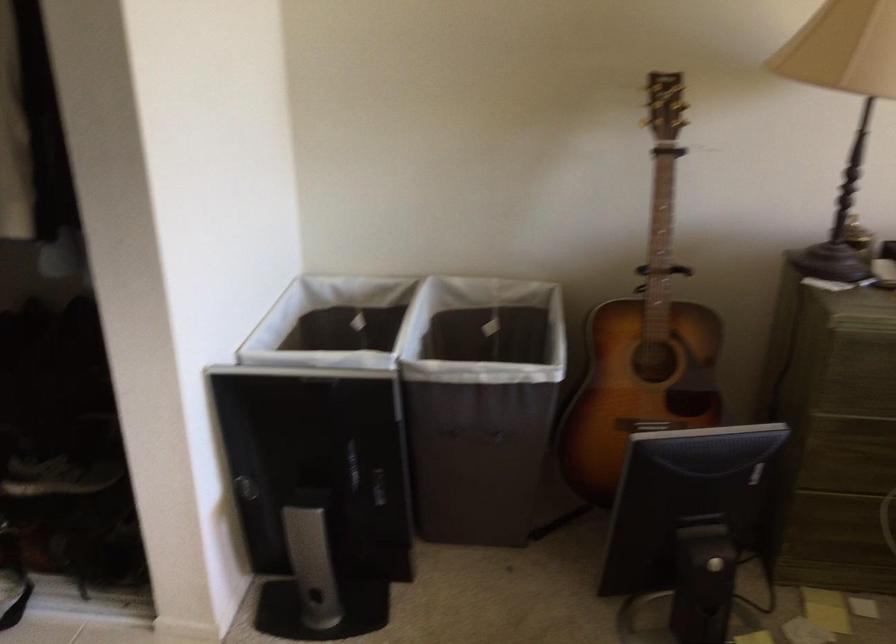
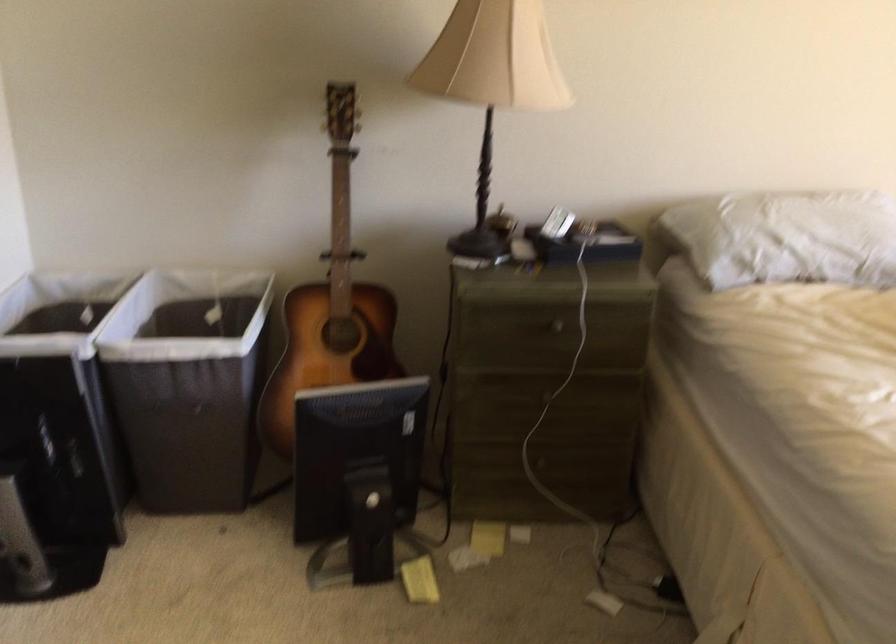
Locate, in the second image, the point that corresponds to [325,317] in the first image.

(57, 310)